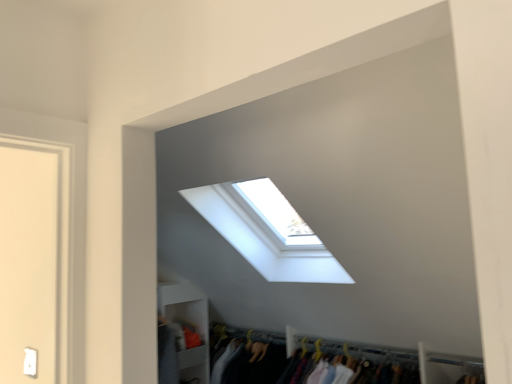
Question: Is white matte shelf at lower left a part of transparent glass window at upper center?

Choices:
 (A) yes
 (B) no

Answer: (B)

Question: From a real-world perspective, is transparent glass window at upper center located higher than white matte shelf at lower left?

Choices:
 (A) yes
 (B) no

Answer: (A)

Question: Can you confirm if transparent glass window at upper center is thinner than white matte shelf at lower left?

Choices:
 (A) yes
 (B) no

Answer: (B)

Question: Can you confirm if transparent glass window at upper center is wider than white matte shelf at lower left?

Choices:
 (A) no
 (B) yes

Answer: (B)

Question: From the image's perspective, is transparent glass window at upper center on top of white matte shelf at lower left?

Choices:
 (A) no
 (B) yes

Answer: (B)

Question: Is transparent glass window at upper center next to white matte shelf at lower left?

Choices:
 (A) no
 (B) yes

Answer: (A)

Question: Is white matte shelf at lower left further to the viewer compared to transparent glass window at upper center?

Choices:
 (A) yes
 (B) no

Answer: (A)

Question: Could you tell me if white matte shelf at lower left is turned towards transparent glass window at upper center?

Choices:
 (A) no
 (B) yes

Answer: (B)

Question: Is white matte shelf at lower left completely or partially outside of transparent glass window at upper center?

Choices:
 (A) yes
 (B) no

Answer: (A)

Question: Is white matte shelf at lower left not near transparent glass window at upper center?

Choices:
 (A) no
 (B) yes

Answer: (A)

Question: From the image's perspective, is white matte shelf at lower left located above transparent glass window at upper center?

Choices:
 (A) yes
 (B) no

Answer: (B)

Question: Is white matte shelf at lower left wider than transparent glass window at upper center?

Choices:
 (A) yes
 (B) no

Answer: (B)

Question: From a real-world perspective, is transparent glass window at upper center physically located above or below white matte shelf at lower left?

Choices:
 (A) above
 (B) below

Answer: (A)